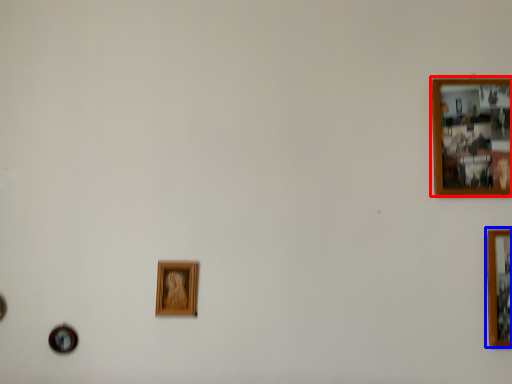
Question: Which object appears farthest to the camera in this image, picture frame (highlighted by a red box) or picture frame (highlighted by a blue box)?

Choices:
 (A) picture frame
 (B) picture frame

Answer: (A)